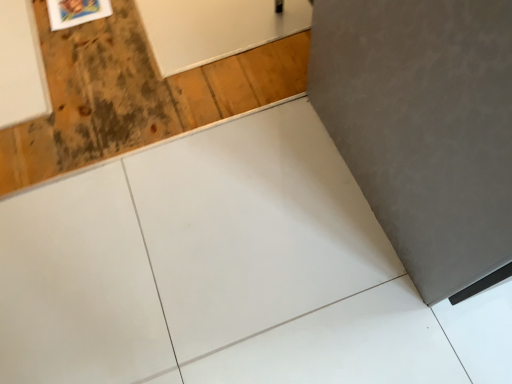
Question: Based on their positions, is wooden plywood at upper left located to the left or right of wooden frame at upper left?

Choices:
 (A) right
 (B) left

Answer: (A)

Question: Is wooden plywood at upper left inside the boundaries of wooden frame at upper left, or outside?

Choices:
 (A) outside
 (B) inside

Answer: (A)

Question: Considering the positions of point (89, 46) and point (69, 0), is point (89, 46) closer or farther from the camera than point (69, 0)?

Choices:
 (A) farther
 (B) closer

Answer: (B)

Question: Is wooden frame at upper left spatially inside wooden plywood at upper left, or outside of it?

Choices:
 (A) inside
 (B) outside

Answer: (A)

Question: Would you say wooden frame at upper left is to the left or to the right of wooden plywood at upper left in the picture?

Choices:
 (A) left
 (B) right

Answer: (A)

Question: Is point (52, 11) positioned closer to the camera than point (135, 41)?

Choices:
 (A) closer
 (B) farther

Answer: (B)

Question: Considering their positions, is wooden frame at upper left located in front of or behind wooden plywood at upper left?

Choices:
 (A) front
 (B) behind

Answer: (B)